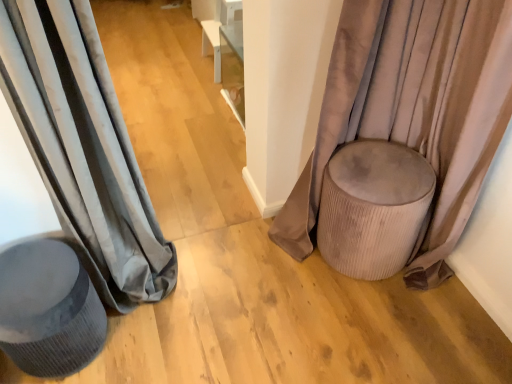
Question: In the image, is matte gray curtain at left, the 2th curtain positioned from the right, on the left side or the right side of velvet beige pouf at right, the 1th curtain positioned from the right?

Choices:
 (A) right
 (B) left

Answer: (B)

Question: From a real-world perspective, is matte gray curtain at left, the 1th curtain viewed from the left, physically located above or below velvet beige pouf at right, the 2th curtain viewed from the left?

Choices:
 (A) below
 (B) above

Answer: (B)

Question: Estimate the real-world distances between objects in this image. Which object is closer to the matte gray curtain at left, the 2th curtain positioned from the right?

Choices:
 (A) suede beige ottoman at right
 (B) matte gray stool at left
 (C) velvet beige pouf at right, the 2th curtain viewed from the left

Answer: (B)

Question: Which object is the closest to the velvet beige pouf at right, the 1th curtain positioned from the right?

Choices:
 (A) matte gray curtain at left, the 1th curtain viewed from the left
 (B) matte gray stool at left
 (C) suede beige ottoman at right

Answer: (C)